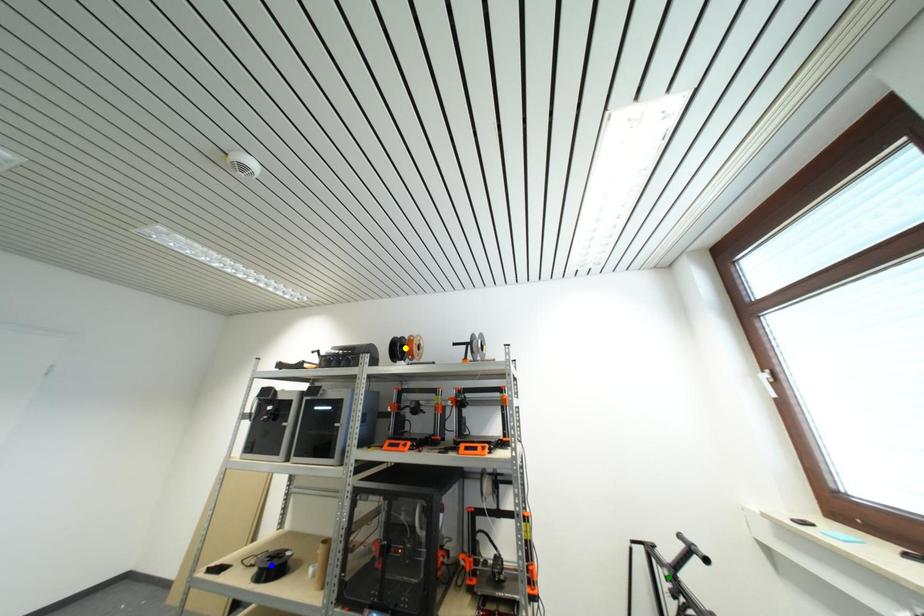
Order these from nearest to farthest:
blue point | yellow point | green point

green point, blue point, yellow point